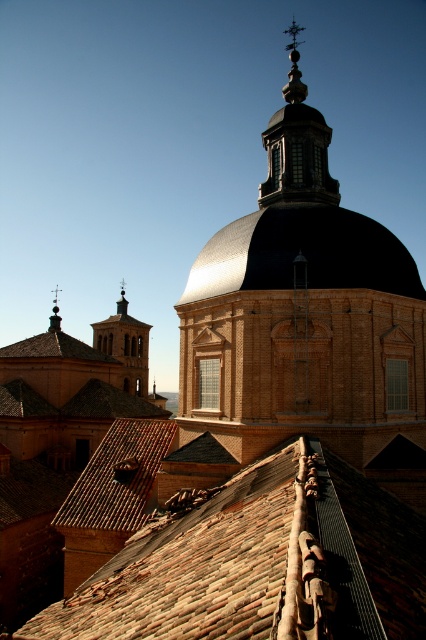
Question: Among these objects, which one is nearest to the camera?

Choices:
 (A) brick textured dome at center
 (B) polished brass spire at upper left

Answer: (A)

Question: Is shiny metallic dome at center above polished brass spire at upper left?

Choices:
 (A) no
 (B) yes

Answer: (B)

Question: Is brown clay tiles at center behind polished brass spire at upper left?

Choices:
 (A) yes
 (B) no

Answer: (B)

Question: Is the position of brick textured dome at center less distant than that of polished brass spire at upper left?

Choices:
 (A) no
 (B) yes

Answer: (B)

Question: Which object appears farthest from the camera in this image?

Choices:
 (A) shiny metallic dome at center
 (B) brown clay tiles at center

Answer: (A)

Question: Which point is closer to the camera?

Choices:
 (A) (290, 424)
 (B) (245, 253)
 (C) (57, 291)

Answer: (A)